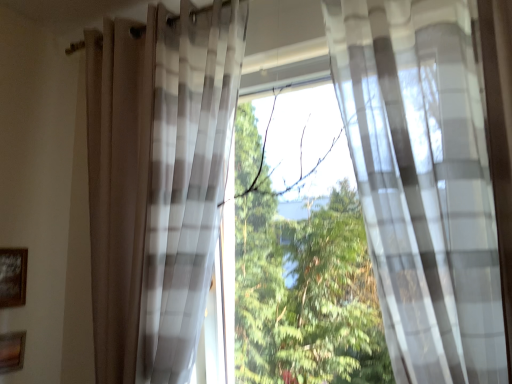
Question: Considering the positions of point (0, 354) and point (18, 274), is point (0, 354) closer or farther from the camera than point (18, 274)?

Choices:
 (A) closer
 (B) farther

Answer: (A)

Question: In terms of height, does wooden picture frame at lower left, marked as the second picture frame in a top-to-bottom arrangement, look taller or shorter compared to wooden framed picture at lower left, which is the first picture frame from top to bottom?

Choices:
 (A) tall
 (B) short

Answer: (B)

Question: Which of these objects is positioned closest to the translucent plaid curtain at center, which is the 1th curtain in left-to-right order?

Choices:
 (A) wooden picture frame at lower left, the 1th picture frame in the bottom-to-top sequence
 (B) wooden framed picture at lower left, the 2th picture frame ordered from the bottom
 (C) translucent white curtain at center, the 1th curtain viewed from the right

Answer: (C)

Question: Which is nearer to the translucent plaid curtain at center, which is the 1th curtain in left-to-right order?

Choices:
 (A) wooden framed picture at lower left, the 2th picture frame ordered from the bottom
 (B) translucent white curtain at center, the 1th curtain viewed from the right
 (C) wooden picture frame at lower left, marked as the second picture frame in a top-to-bottom arrangement

Answer: (B)